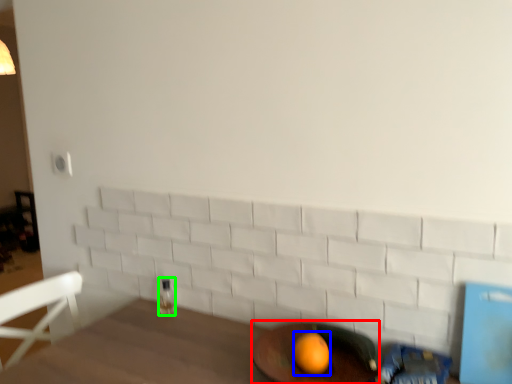
Question: Which is farther away from round table (highlighted by a red box)? orange (highlighted by a blue box) or beverage (highlighted by a green box)?

Choices:
 (A) orange
 (B) beverage

Answer: (B)